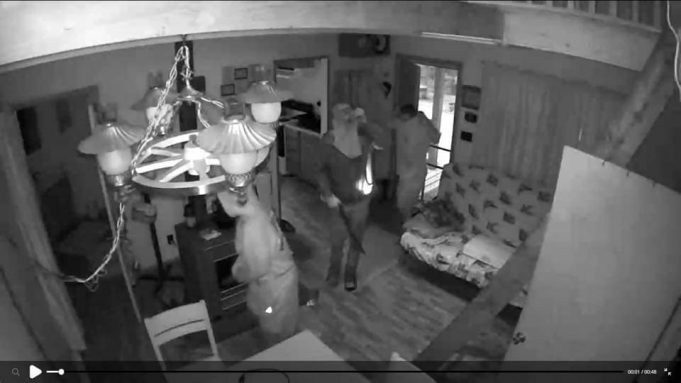
The image size is (681, 383). In order to click on door in this screenshot , I will do `click(611, 256)`.